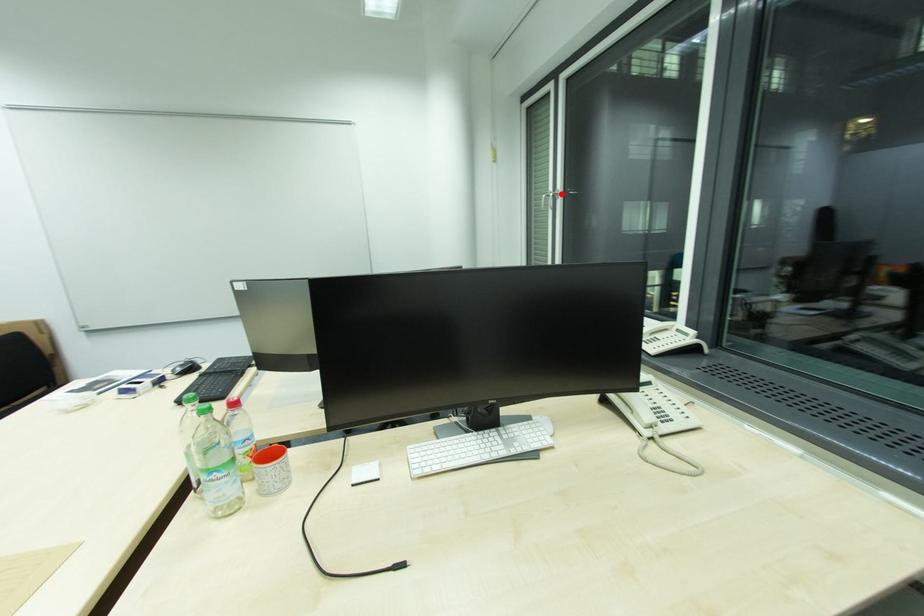
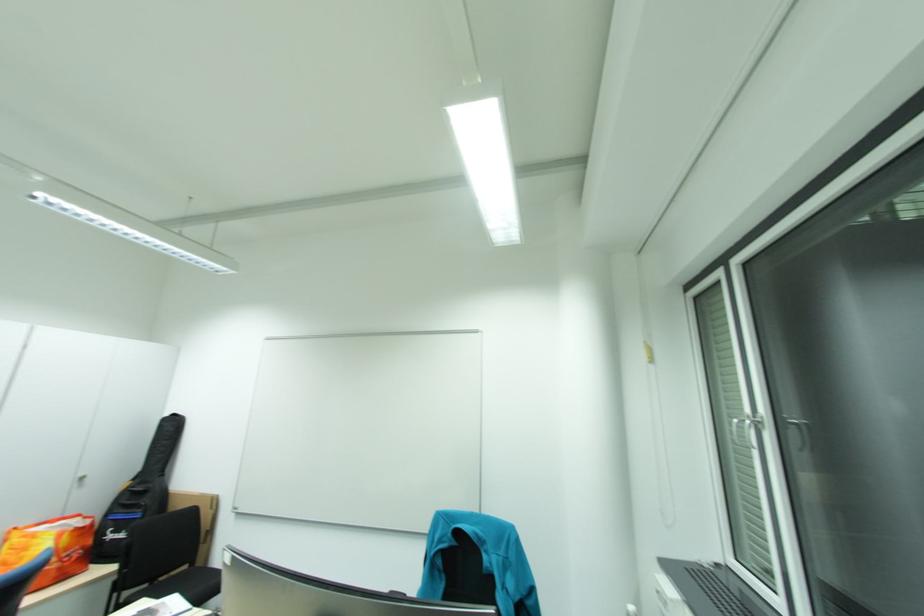
Find the pixel in the second image that matches the highlighted location in the first image.

(755, 421)